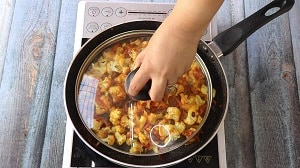
Find the location of a particular element. handle is located at coordinates (143, 95).